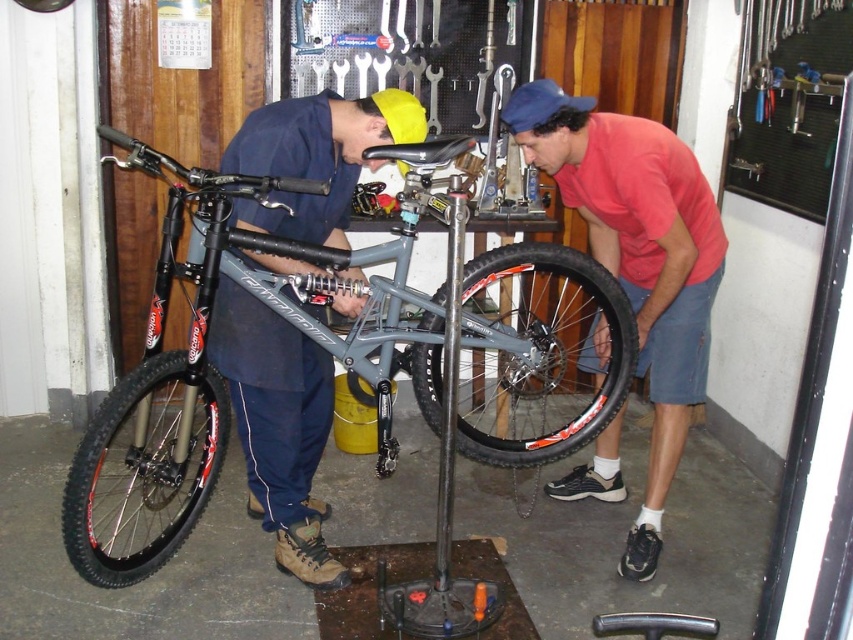
You are a customer who wants to know which technician is closer to the bicycle. The red shirt at right and the matte blue shirt at center are both working on the bicycle. Which one is closer to the bicycle?

The matte blue shirt at center is closer to the bicycle because the red shirt at right is further away from the bicycle.

What is the 2D coordinate of the black rubber tire at center?

The black rubber tire at center is located at the 2D coordinate point of (540, 355).

You are standing in the garage and see the red shirt at right and the black rubber tire at lower left. Which object is located more to the right?

The red shirt at right is more to the right than the black rubber tire at lower left.